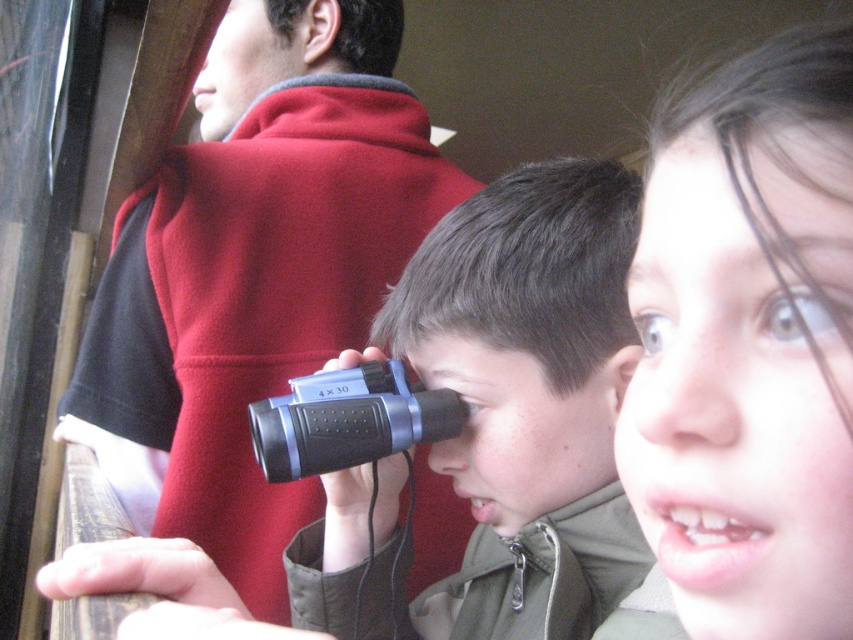
Question: Among these objects, which one is nearest to the camera?

Choices:
 (A) red fleece jacket at upper center
 (B) black plastic binoculars at center
 (C) smooth skin face at upper right

Answer: (C)

Question: Which object appears closest to the camera in this image?

Choices:
 (A) blue plastic binoculars at center
 (B) red fleece jacket at upper center
 (C) black plastic binoculars at center

Answer: (A)

Question: Does red fleece jacket at upper center appear on the left side of smooth skin face at upper right?

Choices:
 (A) yes
 (B) no

Answer: (A)

Question: Which object is farther from the camera taking this photo?

Choices:
 (A) red fleece jacket at upper center
 (B) smooth skin face at upper right

Answer: (A)

Question: From the image, what is the correct spatial relationship of red fleece jacket at upper center in relation to smooth skin face at upper right?

Choices:
 (A) above
 (B) below

Answer: (A)

Question: In this image, where is blue plastic binoculars at center located relative to black plastic binoculars at center?

Choices:
 (A) below
 (B) above

Answer: (B)